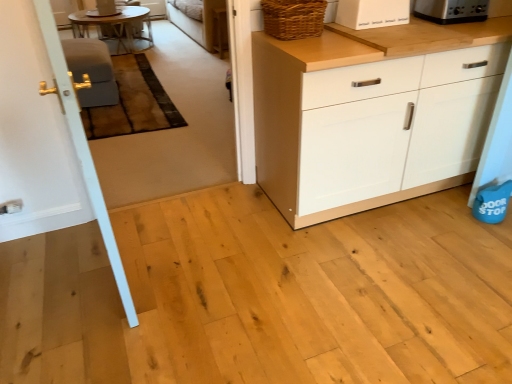
Where is `vacant region to the right of white painted wood door at left`? The image size is (512, 384). vacant region to the right of white painted wood door at left is located at coordinates (204, 261).